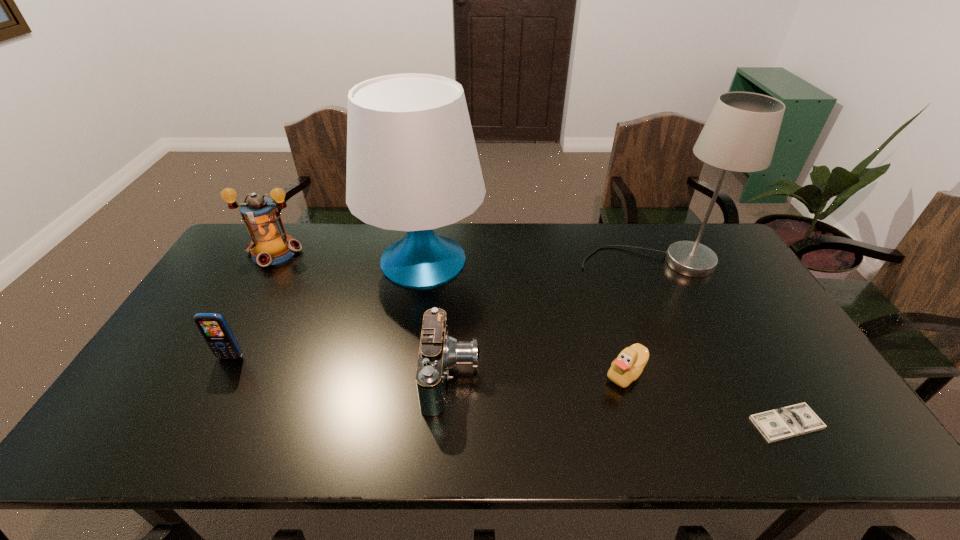
Identify the location of cellular telephone located in the left edge section of the desktop. (213, 327).

Where is `table lamp positioned at the right edge`? This screenshot has height=540, width=960. table lamp positioned at the right edge is located at coordinates (740, 135).

Identify the location of dollar that is at the right edge. The height and width of the screenshot is (540, 960). (778, 424).

Image resolution: width=960 pixels, height=540 pixels. Identify the location of object that is at the far left corner. (270, 244).

Locate an element on the screen. Image resolution: width=960 pixels, height=540 pixels. object situated at the far right corner is located at coordinates (740, 135).

You are a GUI agent. You are given a task and a screenshot of the screen. Output one action in this format:
    pyautogui.click(x=<x>, y=<y>)
    Task: Click on the object situated at the near right corner
    The width and height of the screenshot is (960, 540).
    Given the screenshot: What is the action you would take?
    pyautogui.click(x=778, y=424)

Identify the location of free space at the far edge of the desktop. This screenshot has height=540, width=960. (366, 239).

You are a GUI agent. You are given a task and a screenshot of the screen. Output one action in this format:
    pyautogui.click(x=<x>, y=<y>)
    Task: Click on the free spot at the near edge of the desktop
    The height and width of the screenshot is (540, 960).
    Given the screenshot: What is the action you would take?
    pyautogui.click(x=343, y=439)

In the image, there is a desktop. At what (x,y) coordinates should I click in order to perform the action: click on vacant space at the right edge. Please return your answer as a coordinate pair (x, y). This screenshot has width=960, height=540. Looking at the image, I should click on (781, 326).

In the image, there is a desktop. Where is `vacant space at the far right corner`? This screenshot has height=540, width=960. vacant space at the far right corner is located at coordinates (691, 230).